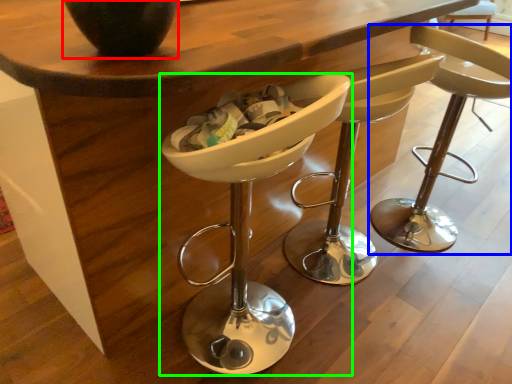
Question: Estimate the real-world distances between objects in this image. Which object is closer to vase (highlighted by a red box), chair (highlighted by a blue box) or chair (highlighted by a green box)?

Choices:
 (A) chair
 (B) chair

Answer: (B)